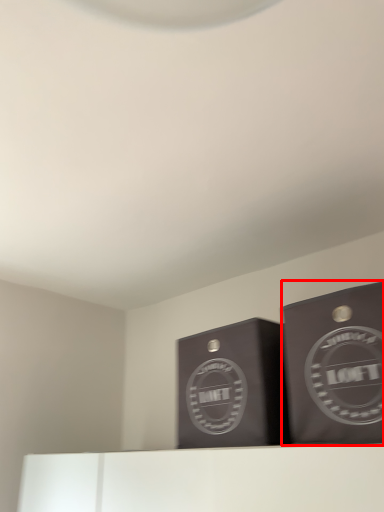
Question: Where is cardboard box (annotated by the red box) located in relation to cardboard box in the image?

Choices:
 (A) right
 (B) left

Answer: (A)